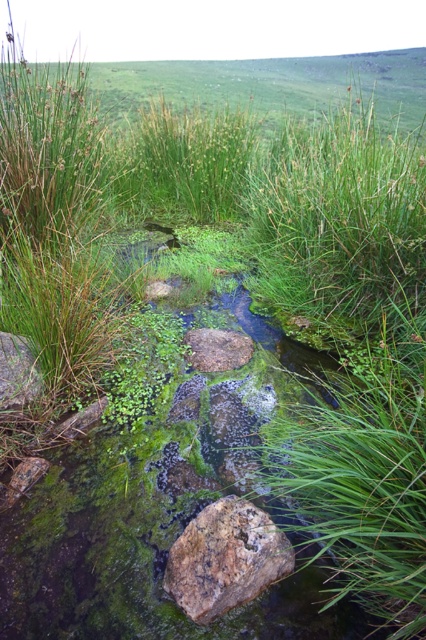
You are a geologist examining the stream. You notice two brown rough rocks at the center of the stream. How far apart are the brown rough rock at center and the brown rough stone at center?

The brown rough rock at center and the brown rough stone at center are 1.60 meters apart.

You are a hiker who wants to cross the stream using the rocks. The smooth gray rock at lower left and the brown rough stone at center are the only two rocks available. Which rock should you step on first to start your crossing?

You should step on the smooth gray rock at lower left first because it is taller than the brown rough stone at center, providing a better starting point for crossing the stream.

You are standing by the stream and want to cross it using the rocks. The brown rough rock at center and the brown rough stone at center are both in your path. Which one should you step on first to ensure stability?

You should step on the brown rough rock at center first because it is larger in size than the brown rough stone at center, providing a more stable footing.